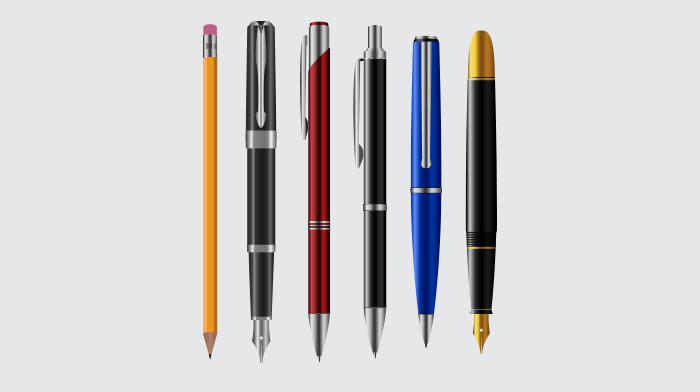
Identify the location of pens. The image size is (700, 392). (262, 172), (323, 177), (377, 184), (421, 182), (481, 175).